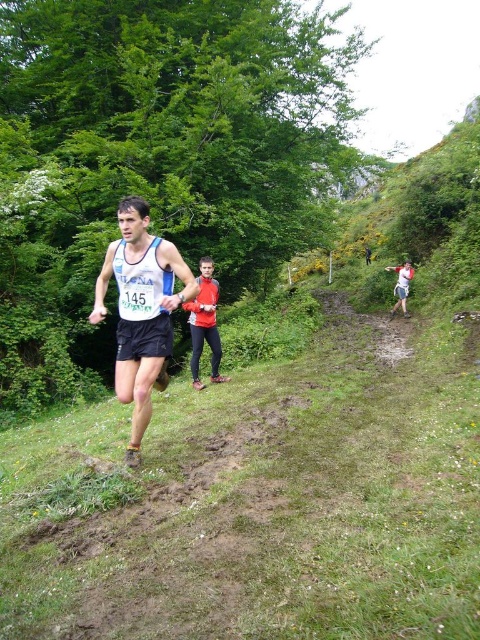
Question: Which object is closer to the camera taking this photo?

Choices:
 (A) matte blue tank top at center
 (B) white cotton shirt at right

Answer: (A)

Question: Can you confirm if red fabric jacket at center is positioned below white cotton shirt at right?

Choices:
 (A) yes
 (B) no

Answer: (A)

Question: Is red fabric jacket at center thinner than white cotton shirt at right?

Choices:
 (A) no
 (B) yes

Answer: (B)

Question: Which point is farther to the camera?

Choices:
 (A) (402, 269)
 (B) (135, 340)
 (C) (214, 332)

Answer: (A)

Question: Considering the relative positions of red fabric jacket at center and white cotton shirt at right in the image provided, where is red fabric jacket at center located with respect to white cotton shirt at right?

Choices:
 (A) above
 (B) below

Answer: (B)

Question: Which object is positioned farthest from the matte blue tank top at center?

Choices:
 (A) white cotton shirt at right
 (B) red fabric jacket at center

Answer: (A)